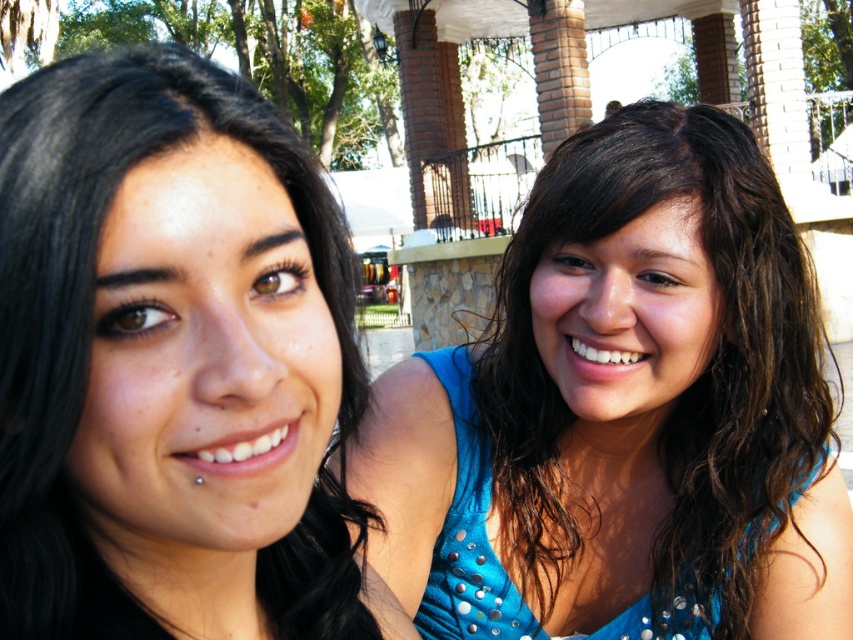
Is blue sequined dress at right thinner than black hair at left?

Incorrect, blue sequined dress at right's width is not less than black hair at left's.

Is point (523, 593) farther from viewer compared to point (175, 609)?

Yes, point (523, 593) is behind point (175, 609).

Identify the location of blue sequined dress at right. This screenshot has height=640, width=853. (624, 412).